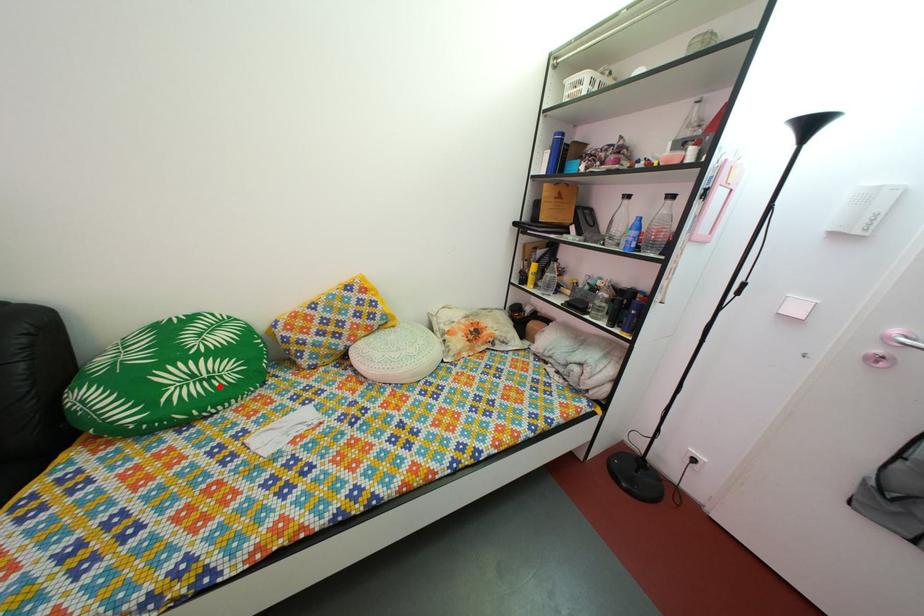
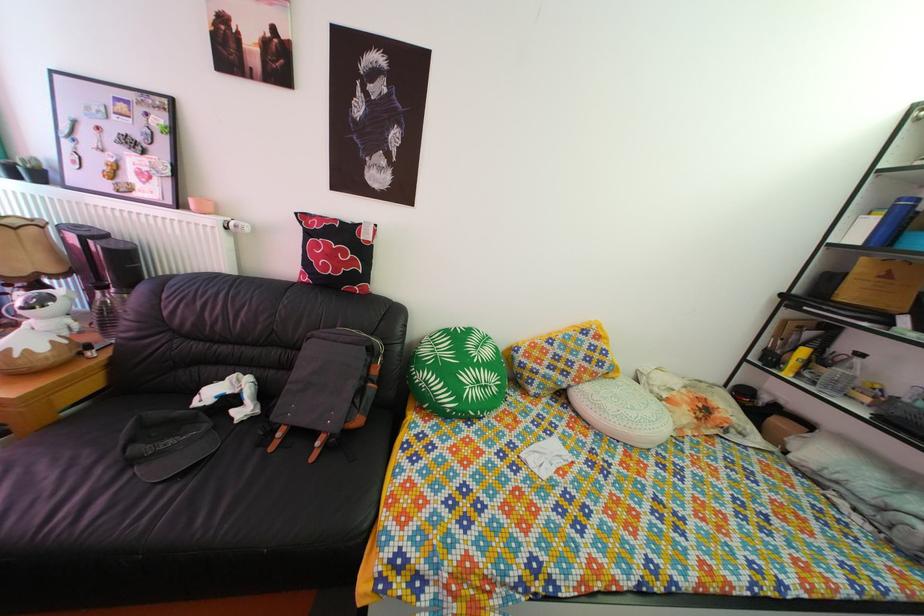
Locate, in the second image, the point that corresponds to the highlighted location in the first image.

(494, 395)